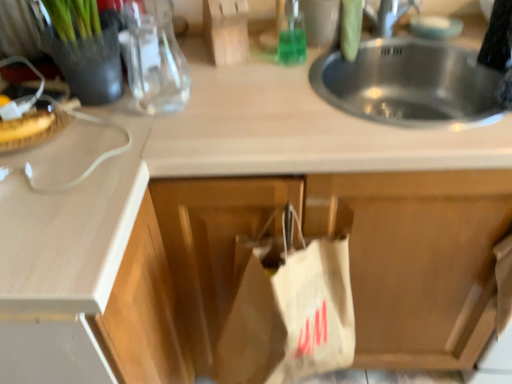
Locate an element on the screen. Image resolution: width=512 pixels, height=384 pixels. free space behind green glass bottle at upper center, which appears as the 1th bottle when viewed from the back is located at coordinates (x=274, y=46).